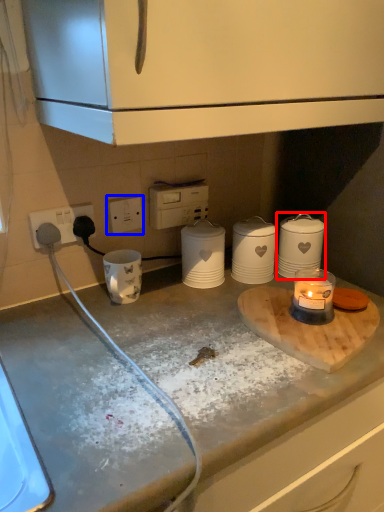
Question: Which of the following is the farthest to the observer, kitchen appliance (highlighted by a red box) or electric outlet (highlighted by a blue box)?

Choices:
 (A) kitchen appliance
 (B) electric outlet

Answer: (A)